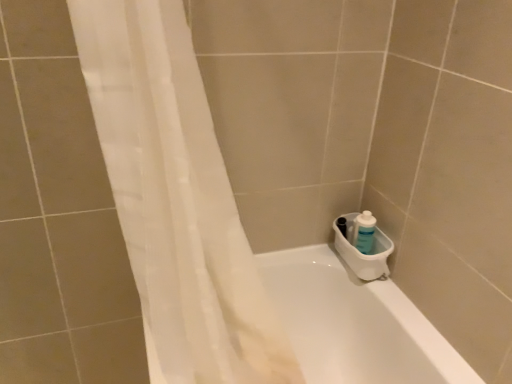
Where is `vacant area that is in front of blue plastic bottle at right`? The height and width of the screenshot is (384, 512). vacant area that is in front of blue plastic bottle at right is located at coordinates (378, 296).